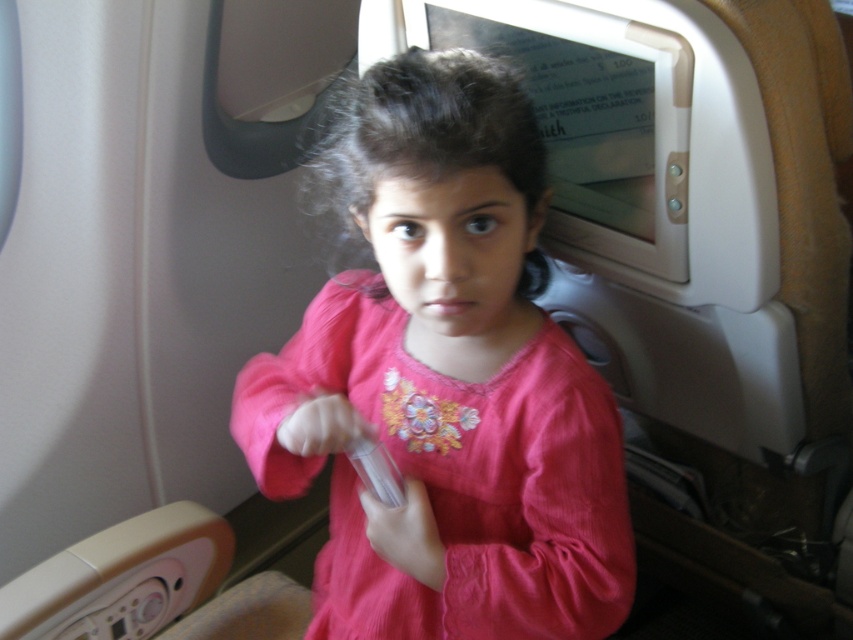
Question: Is pink cotton shirt at center to the left of clear plastic remote at center from the viewer's perspective?

Choices:
 (A) yes
 (B) no

Answer: (B)

Question: Is pink cotton shirt at center above clear plastic remote at center?

Choices:
 (A) no
 (B) yes

Answer: (B)

Question: Is pink cotton shirt at center to the right of clear plastic remote at center from the viewer's perspective?

Choices:
 (A) no
 (B) yes

Answer: (B)

Question: Which object is farther from the camera taking this photo?

Choices:
 (A) pink cotton shirt at center
 (B) clear plastic remote at center

Answer: (B)

Question: Which point is farther to the camera?

Choices:
 (A) (410, 262)
 (B) (373, 480)

Answer: (B)

Question: Which of the following is the closest to the observer?

Choices:
 (A) pink cotton shirt at center
 (B) clear plastic remote at center

Answer: (A)